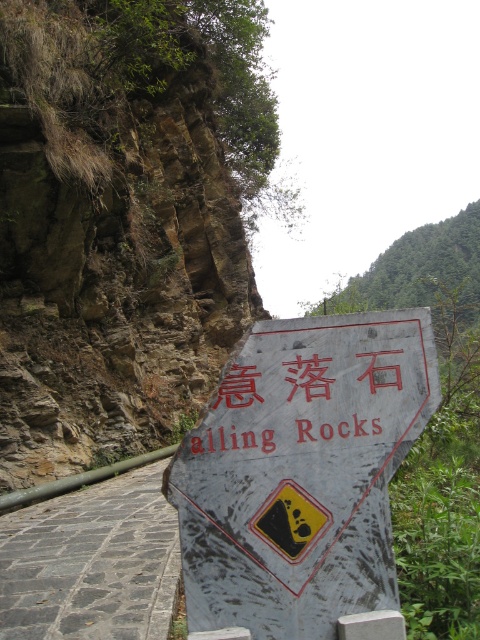
Question: Which object is the closest to the brown rocky hillside at upper left?

Choices:
 (A) weathered gray sign at center
 (B) red painted sign at center
 (C) gray stone path at lower left

Answer: (C)

Question: In this image, where is brown rocky hillside at upper left located relative to weathered gray sign at center?

Choices:
 (A) above
 (B) below

Answer: (A)

Question: Is brown rocky hillside at upper left thinner than red painted sign at center?

Choices:
 (A) no
 (B) yes

Answer: (A)

Question: Among these objects, which one is farthest from the camera?

Choices:
 (A) weathered gray sign at center
 (B) red painted sign at center
 (C) gray stone path at lower left

Answer: (C)

Question: Considering the real-world distances, which object is farthest from the gray stone path at lower left?

Choices:
 (A) weathered gray sign at center
 (B) red painted sign at center

Answer: (B)

Question: Is brown rocky hillside at upper left to the right of red painted sign at center from the viewer's perspective?

Choices:
 (A) yes
 (B) no

Answer: (B)